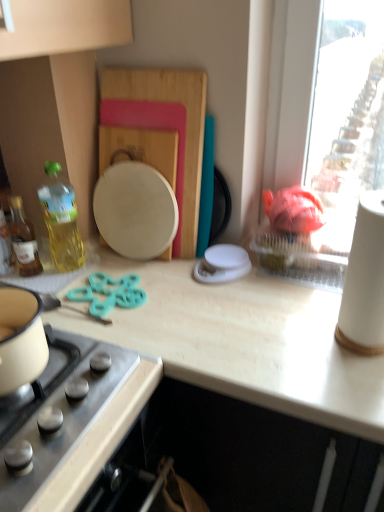
At what (x,y) coordinates should I click in order to perform the action: click on empty space that is ontop of light wood countertop at center (from a real-world perspective). Please return your answer as a coordinate pair (x, y). Image resolution: width=384 pixels, height=512 pixels. Looking at the image, I should click on (203, 289).